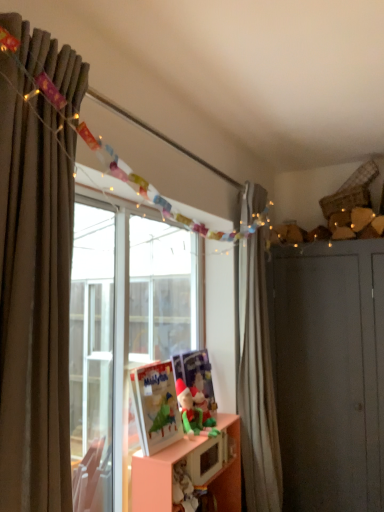
Question: Considering the relative sizes of green plush toy at lower center, which appears as the first toy when viewed from the back, and brown fabric curtain at left, placed as the first curtain when sorted from front to back, in the image provided, is green plush toy at lower center, which appears as the first toy when viewed from the back, thinner than brown fabric curtain at left, placed as the first curtain when sorted from front to back,?

Choices:
 (A) no
 (B) yes

Answer: (B)

Question: Does green plush toy at lower center, which is counted as the 2th toy, starting from the front, appear on the right side of brown fabric curtain at left, which is the second curtain in back-to-front order?

Choices:
 (A) no
 (B) yes

Answer: (B)

Question: Considering the relative sizes of green plush toy at lower center, which is counted as the 2th toy, starting from the front, and brown fabric curtain at left, which ranks as the first curtain in left-to-right order, in the image provided, is green plush toy at lower center, which is counted as the 2th toy, starting from the front, taller than brown fabric curtain at left, which ranks as the first curtain in left-to-right order,?

Choices:
 (A) yes
 (B) no

Answer: (B)

Question: From the image's perspective, does green plush toy at lower center, which appears as the first toy when viewed from the back, appear lower than brown fabric curtain at left, which is the second curtain in back-to-front order?

Choices:
 (A) yes
 (B) no

Answer: (A)

Question: Does green plush toy at lower center, which appears as the first toy when viewed from the back, have a lesser height compared to brown fabric curtain at left, placed as the first curtain when sorted from front to back?

Choices:
 (A) no
 (B) yes

Answer: (B)

Question: Considering the positions of point (185, 420) and point (195, 390), is point (185, 420) closer or farther from the camera than point (195, 390)?

Choices:
 (A) closer
 (B) farther

Answer: (A)

Question: Based on their positions, is green felt santa at center, arranged as the first toy when viewed from the front, located to the left or right of green plush toy at lower center, which is counted as the 2th toy, starting from the front?

Choices:
 (A) left
 (B) right

Answer: (A)

Question: From the image's perspective, is green felt santa at center, arranged as the first toy when viewed from the front, positioned above or below green plush toy at lower center, which is counted as the 2th toy, starting from the front?

Choices:
 (A) above
 (B) below

Answer: (A)

Question: From a real-world perspective, is green felt santa at center, arranged as the first toy when viewed from the front, above or below green plush toy at lower center, which is counted as the 2th toy, starting from the front?

Choices:
 (A) above
 (B) below

Answer: (A)

Question: Based on their positions, is white matte curtain at right, the first curtain when ordered from right to left, located to the left or right of matte gray dresser at right?

Choices:
 (A) right
 (B) left

Answer: (B)

Question: Is white matte curtain at right, acting as the 2th curtain starting from the left, taller or shorter than matte gray dresser at right?

Choices:
 (A) tall
 (B) short

Answer: (A)

Question: Is white matte curtain at right, acting as the 2th curtain starting from the left, spatially inside matte gray dresser at right, or outside of it?

Choices:
 (A) inside
 (B) outside

Answer: (B)

Question: From the image's perspective, is white matte curtain at right, the first curtain positioned from the back, positioned above or below matte gray dresser at right?

Choices:
 (A) above
 (B) below

Answer: (A)

Question: In the image, is green felt santa at center, which is counted as the 2th toy, starting from the back, on the left side or the right side of matte gray dresser at right?

Choices:
 (A) right
 (B) left

Answer: (B)

Question: Choose the correct answer: Is green felt santa at center, arranged as the first toy when viewed from the front, inside matte gray dresser at right or outside it?

Choices:
 (A) outside
 (B) inside

Answer: (A)